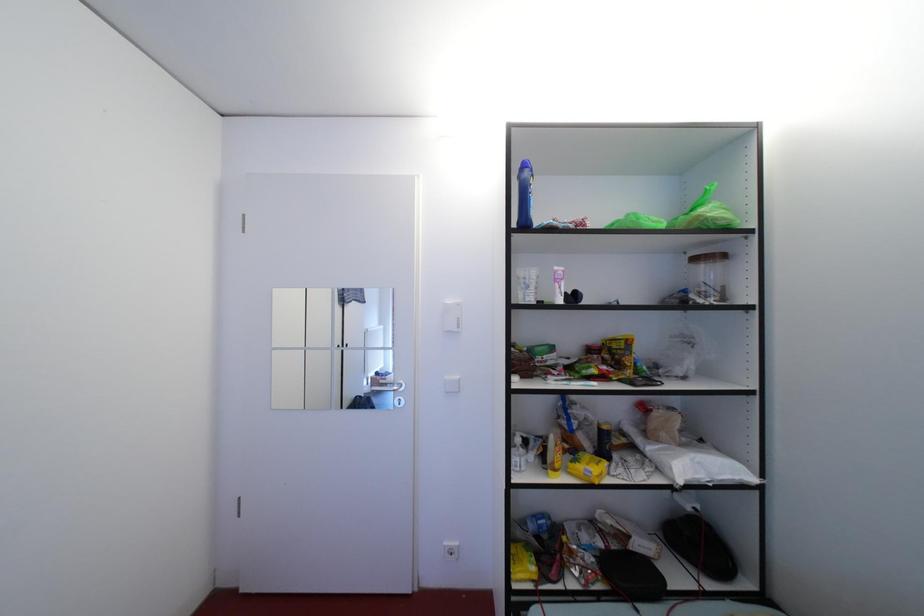
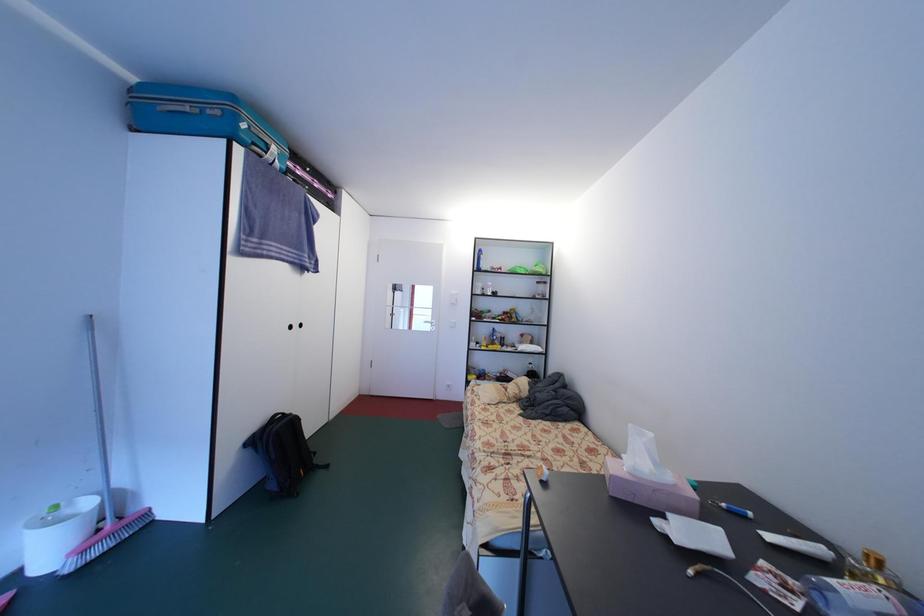
Question: The images are taken continuously from a first-person perspective. In which direction are you moving?

Choices:
 (A) Left
 (B) Right
 (C) Forward
 (D) Backward

Answer: (D)